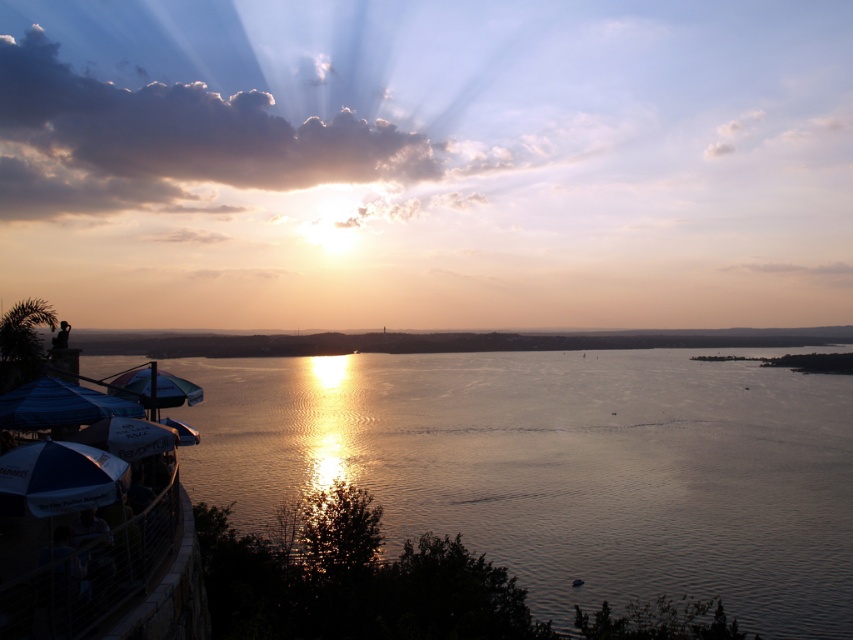
You are a photographer trying to capture the sunset. You have a camera with a 10cm wide lens. The glistening water at center and the white fabric umbrella at lower left are both in your view. Which object will require you to zoom out more to fully capture it in the frame?

The glistening water at center is bigger than the white fabric umbrella at lower left, so you will need to zoom out more to fully capture the glistening water at center in the frame.

You are standing at the point closest to the camera in this sunset scene. Which point, point (x=0, y=515) or point (x=119, y=412), are you currently at?

You are at point (x=0, y=515) because it is closer to the camera than point (x=119, y=412).